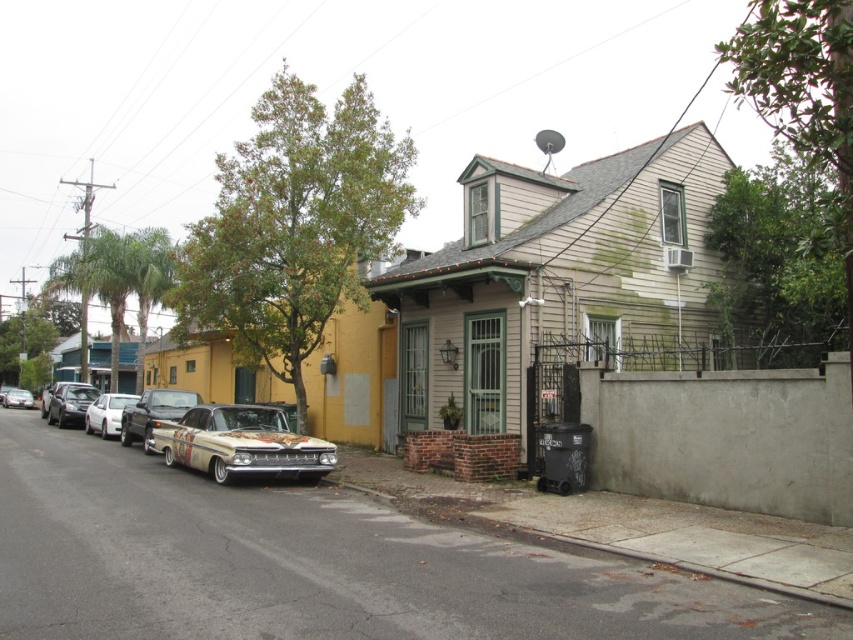
Consider the image. Can you confirm if painted wood car at center is taller than shiny chrome car at center?

Indeed, painted wood car at center has a greater height compared to shiny chrome car at center.

In the scene shown: Which is below, painted wood car at center or shiny chrome car at center?

Positioned lower is shiny chrome car at center.

Which is in front, point (212, 419) or point (129, 417)?

Point (212, 419) is in front.

This screenshot has height=640, width=853. I want to click on painted wood car at center, so pos(241,444).

Locate an element on the screen. gray concrete curb at lower right is located at coordinates (648, 531).

Which is behind, point (807, 584) or point (94, 408)?

Positioned behind is point (94, 408).

The image size is (853, 640). I want to click on gray concrete curb at lower right, so click(648, 531).

This screenshot has height=640, width=853. Identify the location of gray concrete curb at lower right. (648, 531).

Which is below, gray concrete curb at lower right or shiny chrome car at center?

Positioned lower is gray concrete curb at lower right.

Is gray concrete curb at lower right thinner than shiny chrome car at center?

In fact, gray concrete curb at lower right might be wider than shiny chrome car at center.

Locate an element on the screen. The height and width of the screenshot is (640, 853). gray concrete curb at lower right is located at coordinates (648, 531).

You are a GUI agent. You are given a task and a screenshot of the screen. Output one action in this format:
    pyautogui.click(x=<x>, y=<y>)
    Task: Click on the gray concrete curb at lower right
    
    Given the screenshot: What is the action you would take?
    pyautogui.click(x=648, y=531)